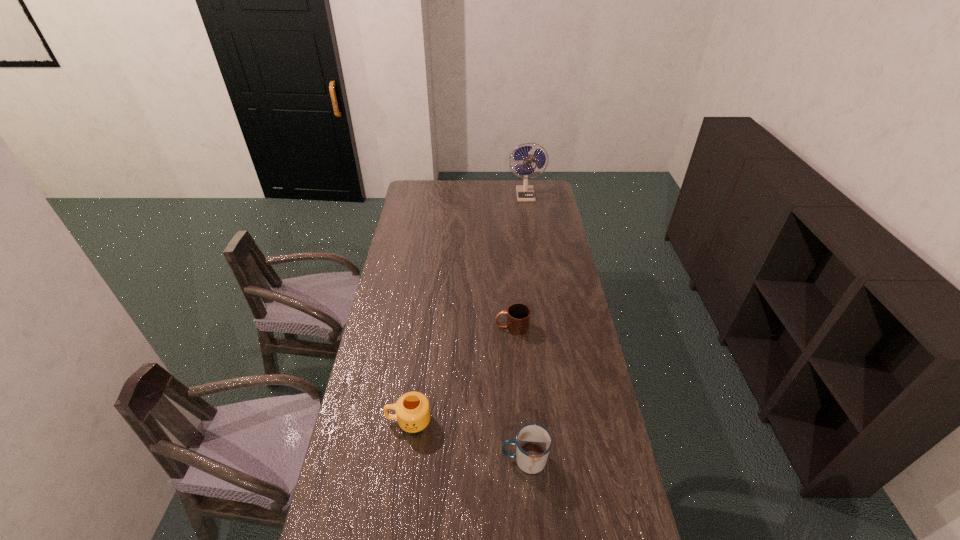
Locate an element on the screen. object at the far right corner is located at coordinates (524, 193).

Identify the location of vacant space at the far edge of the desktop. Image resolution: width=960 pixels, height=540 pixels. (477, 183).

The width and height of the screenshot is (960, 540). In the image, there is a desktop. In order to click on free space at the left edge in this screenshot , I will do click(x=412, y=230).

The height and width of the screenshot is (540, 960). I want to click on vacant space at the right edge of the desktop, so click(564, 236).

In order to click on vacant space in between the third nearest object and the farthest object in this screenshot , I will do `click(518, 261)`.

Locate an element on the screen. This screenshot has width=960, height=540. vacant point located between the farthest mug and the fan is located at coordinates (518, 261).

Find the location of a particular element. free space that is in between the fan and the third nearest object is located at coordinates pos(518,261).

Locate an element on the screen. Image resolution: width=960 pixels, height=540 pixels. object that is the second closest one to the nearest object is located at coordinates (518, 315).

Locate an element on the screen. The width and height of the screenshot is (960, 540). object that is the closest one to the nearest object is located at coordinates (412, 409).

Identify which mug is located as the second nearest to the nearest object. Please provide its 2D coordinates. Your answer should be formatted as a tuple, i.e. [(x, y)], where the tuple contains the x and y coordinates of a point satisfying the conditions above.

[(518, 315)]